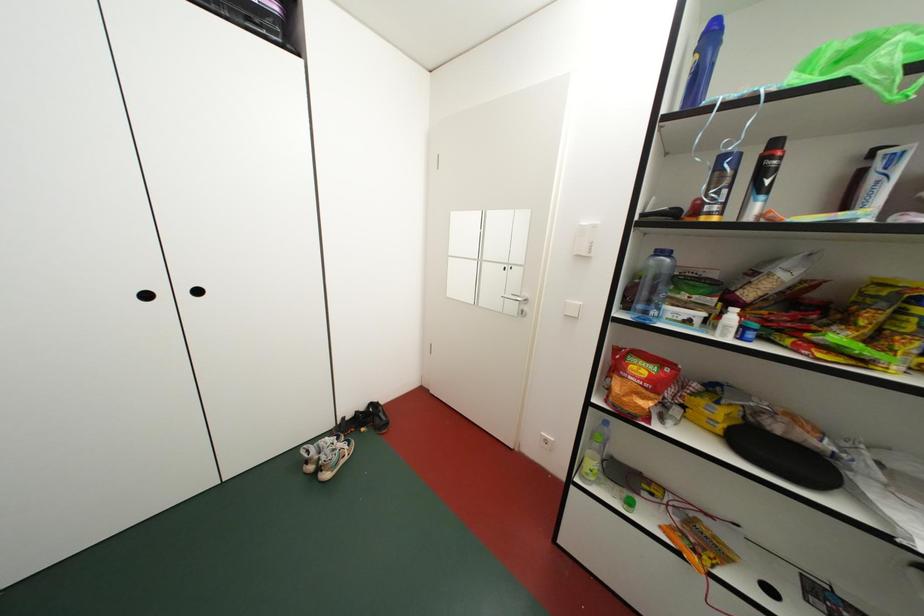
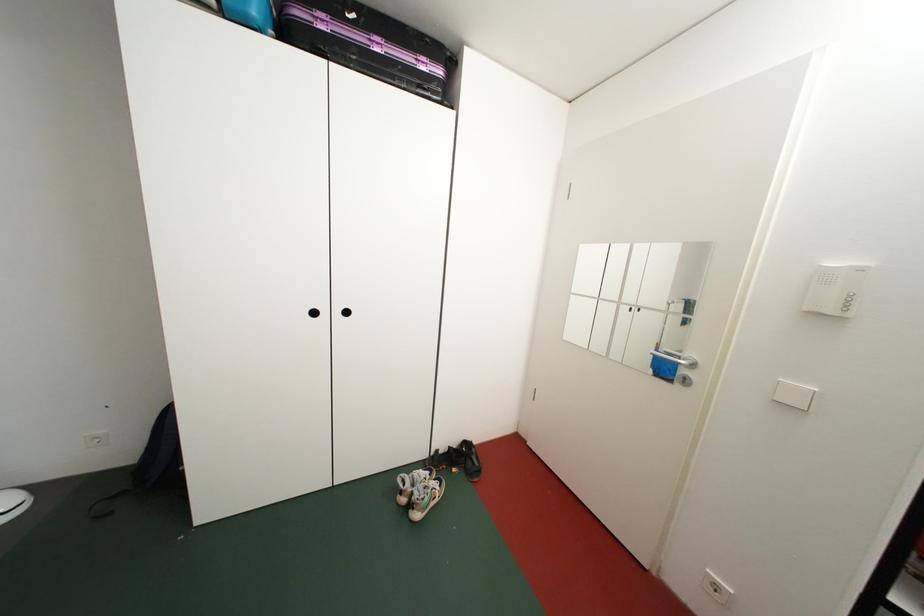
What movement of the cameraman would produce the second image?

The movement direction of the cameraman is left, forward.